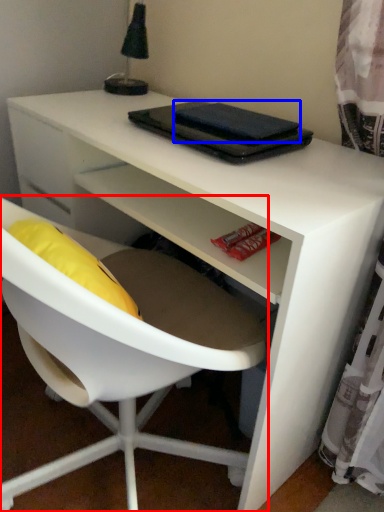
Question: Among these objects, which one is farthest to the camera, chair (highlighted by a red box) or notebook (highlighted by a blue box)?

Choices:
 (A) chair
 (B) notebook

Answer: (B)